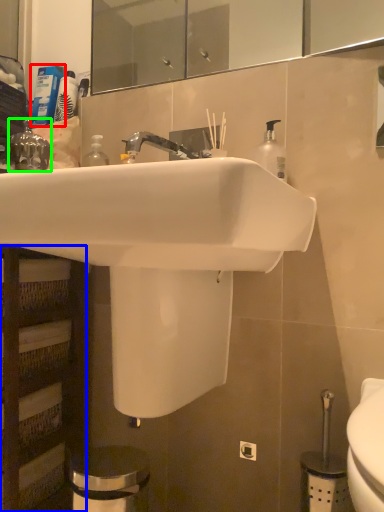
Question: Which object is positioned closest to toiletry (highlighted by a red box)? Select from shelf (highlighted by a blue box) and plumbing fixture (highlighted by a green box).

Choices:
 (A) shelf
 (B) plumbing fixture

Answer: (B)